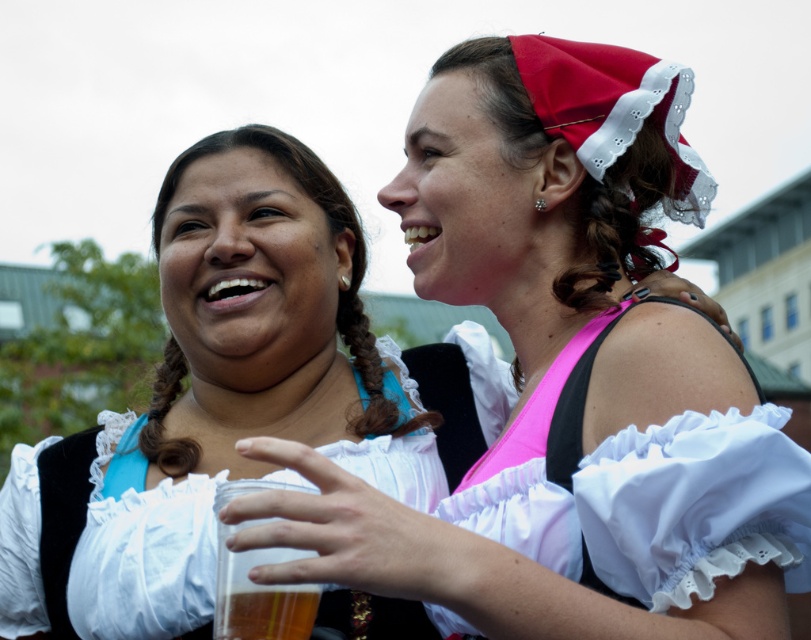
You are a photographer at a cultural event. You need to capture a photo of the pink satin dress at upper right and the translucent plastic cup at center. Which object is positioned higher in the image?

The pink satin dress at upper right is above the translucent plastic cup at center, so the pink satin dress at upper right is positioned higher in the image.

You are an event planner trying to arrange a photo shoot for the cultural event shown. You need to position a decorative arch directly above the matte white blouse at upper center. According to the image, where should you place the arch in terms of coordinates?

The matte white blouse at upper center is located at point (565, 378), so the arch should be placed directly above these coordinates to align with the blouse.